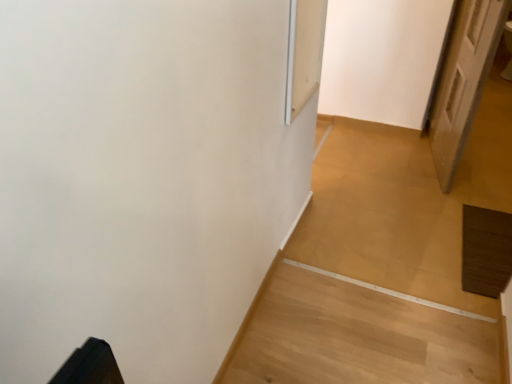
Question: Can you confirm if white wooden door at right is positioned to the left of transparent glass screen door at upper center?

Choices:
 (A) no
 (B) yes

Answer: (A)

Question: Does white wooden door at right have a larger size compared to transparent glass screen door at upper center?

Choices:
 (A) yes
 (B) no

Answer: (A)

Question: Is white wooden door at right oriented towards transparent glass screen door at upper center?

Choices:
 (A) yes
 (B) no

Answer: (B)

Question: Considering the relative sizes of white wooden door at right and transparent glass screen door at upper center in the image provided, is white wooden door at right taller than transparent glass screen door at upper center?

Choices:
 (A) yes
 (B) no

Answer: (A)

Question: Can transparent glass screen door at upper center be found inside white wooden door at right?

Choices:
 (A) no
 (B) yes

Answer: (A)

Question: Is white wooden door at right in contact with transparent glass screen door at upper center?

Choices:
 (A) no
 (B) yes

Answer: (A)

Question: Is transparent glass screen door at upper center closer to the viewer compared to white wooden door at right?

Choices:
 (A) yes
 (B) no

Answer: (A)

Question: From the image's perspective, does transparent glass screen door at upper center appear higher than white wooden door at right?

Choices:
 (A) yes
 (B) no

Answer: (B)

Question: Considering the relative positions of transparent glass screen door at upper center and white wooden door at right in the image provided, is transparent glass screen door at upper center to the right of white wooden door at right from the viewer's perspective?

Choices:
 (A) yes
 (B) no

Answer: (B)

Question: From a real-world perspective, is transparent glass screen door at upper center located higher than white wooden door at right?

Choices:
 (A) no
 (B) yes

Answer: (B)

Question: Can white wooden door at right be found inside transparent glass screen door at upper center?

Choices:
 (A) yes
 (B) no

Answer: (B)

Question: Does transparent glass screen door at upper center have a lesser height compared to white wooden door at right?

Choices:
 (A) yes
 (B) no

Answer: (A)

Question: Do you think white wooden door at right is within transparent glass screen door at upper center, or outside of it?

Choices:
 (A) outside
 (B) inside

Answer: (A)